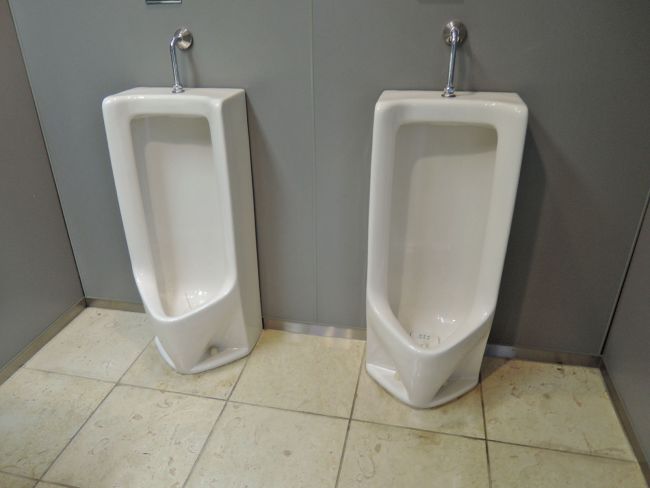
The image size is (650, 488). I want to click on tile, so click(395, 462).